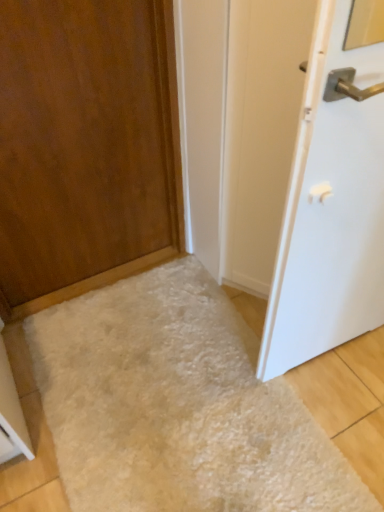
Question: Considering the relative positions of wooden door at left, the second door in the right-to-left sequence, and white fluffy rug at lower center in the image provided, is wooden door at left, the second door in the right-to-left sequence, to the left of white fluffy rug at lower center from the viewer's perspective?

Choices:
 (A) yes
 (B) no

Answer: (A)

Question: Can you confirm if wooden door at left, the second door in the right-to-left sequence, is wider than white fluffy rug at lower center?

Choices:
 (A) yes
 (B) no

Answer: (B)

Question: From a real-world perspective, does wooden door at left, the second door in the right-to-left sequence, sit lower than white fluffy rug at lower center?

Choices:
 (A) yes
 (B) no

Answer: (B)

Question: Are wooden door at left, the second door in the right-to-left sequence, and white fluffy rug at lower center making contact?

Choices:
 (A) yes
 (B) no

Answer: (B)

Question: Is wooden door at left, the first door in the left-to-right sequence, smaller than white fluffy rug at lower center?

Choices:
 (A) no
 (B) yes

Answer: (A)

Question: Relative to white fluffy rug at lower center, is white glossy door at right, positioned as the 1th door in right-to-left order, in front or behind?

Choices:
 (A) behind
 (B) front

Answer: (B)

Question: Considering the positions of white glossy door at right, which is the second door from left to right, and white fluffy rug at lower center in the image, is white glossy door at right, which is the second door from left to right, bigger or smaller than white fluffy rug at lower center?

Choices:
 (A) big
 (B) small

Answer: (A)

Question: Is white glossy door at right, which is the second door from left to right, wider or thinner than white fluffy rug at lower center?

Choices:
 (A) thin
 (B) wide

Answer: (A)

Question: From the image's perspective, is white glossy door at right, positioned as the 1th door in right-to-left order, above or below white fluffy rug at lower center?

Choices:
 (A) above
 (B) below

Answer: (A)

Question: In terms of width, does white fluffy rug at lower center look wider or thinner when compared to wooden door at left, the second door in the right-to-left sequence?

Choices:
 (A) thin
 (B) wide

Answer: (B)

Question: Is white fluffy rug at lower center situated inside wooden door at left, the second door in the right-to-left sequence, or outside?

Choices:
 (A) outside
 (B) inside

Answer: (A)

Question: From a real-world perspective, is white fluffy rug at lower center physically located above or below wooden door at left, the first door in the left-to-right sequence?

Choices:
 (A) below
 (B) above

Answer: (A)

Question: Is point (72, 353) closer or farther from the camera than point (61, 117)?

Choices:
 (A) farther
 (B) closer

Answer: (A)

Question: In the image, is white glossy door at right, positioned as the 1th door in right-to-left order, on the left side or the right side of wooden door at left, the first door in the left-to-right sequence?

Choices:
 (A) right
 (B) left

Answer: (A)

Question: Is white glossy door at right, positioned as the 1th door in right-to-left order, inside or outside of wooden door at left, the first door in the left-to-right sequence?

Choices:
 (A) outside
 (B) inside

Answer: (A)